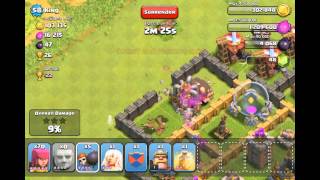
Find the location of a particular element. The height and width of the screenshot is (180, 320). tan wall is located at coordinates (214, 114).